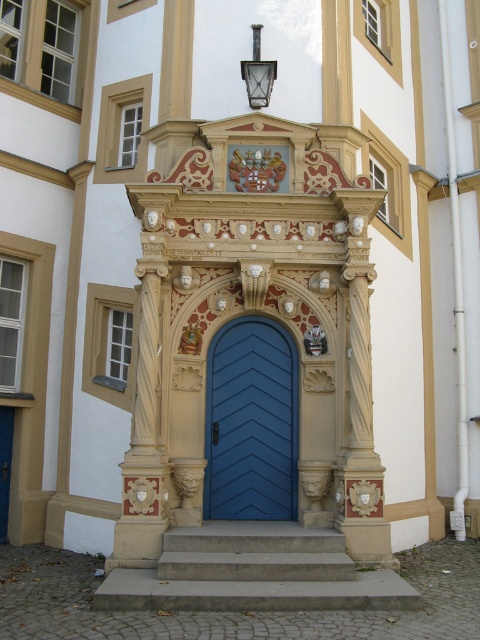
You are a visitor approaching the entrance of the building. You need to reach the blue wooden door at center. Which direction should you move relative to the concrete steps at center?

You should move to the right relative to the concrete steps at center because the concrete steps at center is to the left of blue wooden door at center.

You are a delivery person carrying a large package and need to approach the entrance. The concrete steps at center lead up to the blue wooden door at center. Considering their sizes, which one should you focus on to ensure you can carry the package safely up to the door?

The concrete steps at center are larger than the blue wooden door at center, so you should focus on navigating the steps carefully to ensure safe passage with your package.